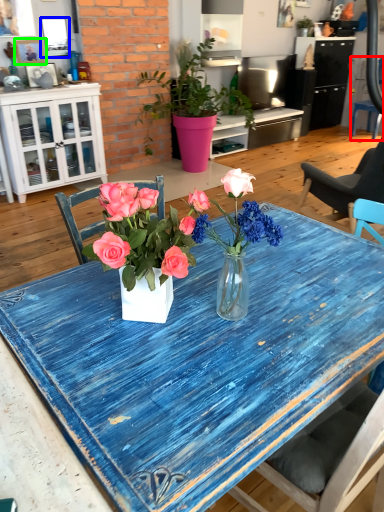
Question: Estimate the real-world distances between objects in this image. Which object is closer to chair (highlighted by a red box), picture frame (highlighted by a blue box) or picture frame (highlighted by a green box)?

Choices:
 (A) picture frame
 (B) picture frame

Answer: (A)